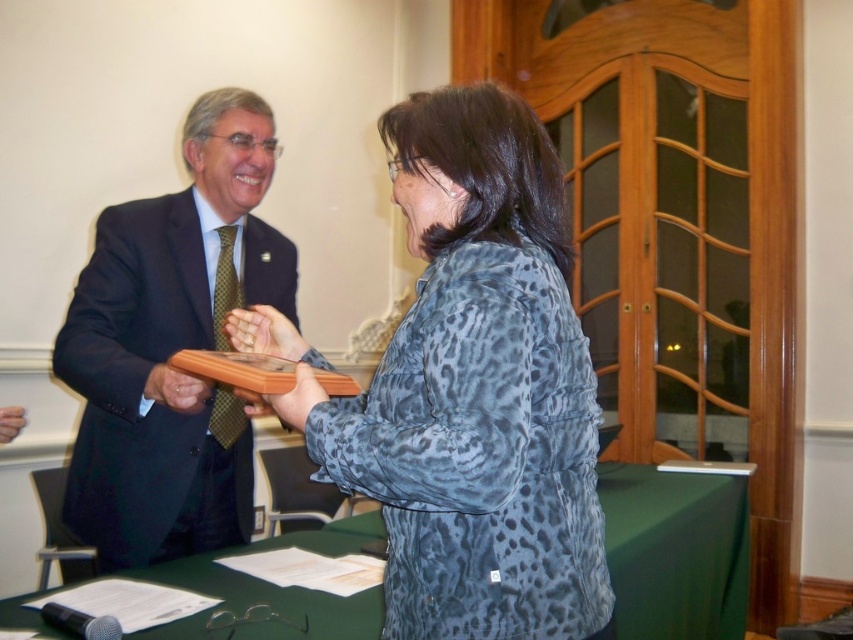
Question: Which point appears farthest from the camera in this image?

Choices:
 (A) (434, 444)
 (B) (135, 225)

Answer: (B)

Question: Considering the relative positions of leopard print jacket at center and green fabric table at center in the image provided, where is leopard print jacket at center located with respect to green fabric table at center?

Choices:
 (A) above
 (B) below

Answer: (A)

Question: Can you confirm if matte black suit at left is positioned to the left of green fabric table at center?

Choices:
 (A) no
 (B) yes

Answer: (B)

Question: From the image, what is the correct spatial relationship of matte black suit at left in relation to green fabric table at center?

Choices:
 (A) right
 (B) left

Answer: (B)

Question: Based on their relative distances, which object is nearer to the green fabric table at center?

Choices:
 (A) matte black suit at left
 (B) leopard print jacket at center

Answer: (B)

Question: Which point appears closest to the camera in this image?

Choices:
 (A) (608, 529)
 (B) (200, 500)

Answer: (B)